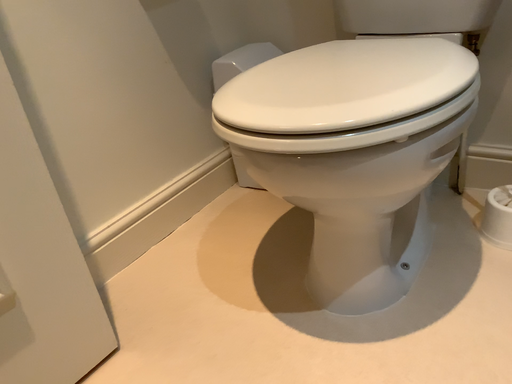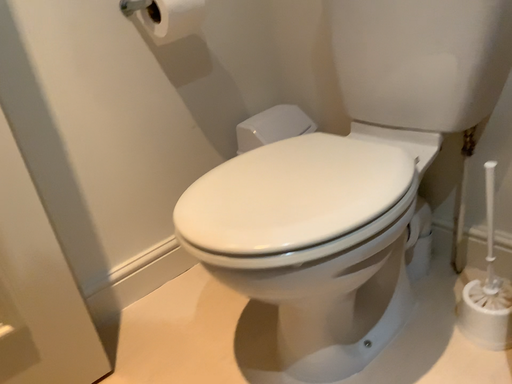
Question: How did the camera likely rotate when shooting the video?

Choices:
 (A) rotated right
 (B) rotated left

Answer: (B)